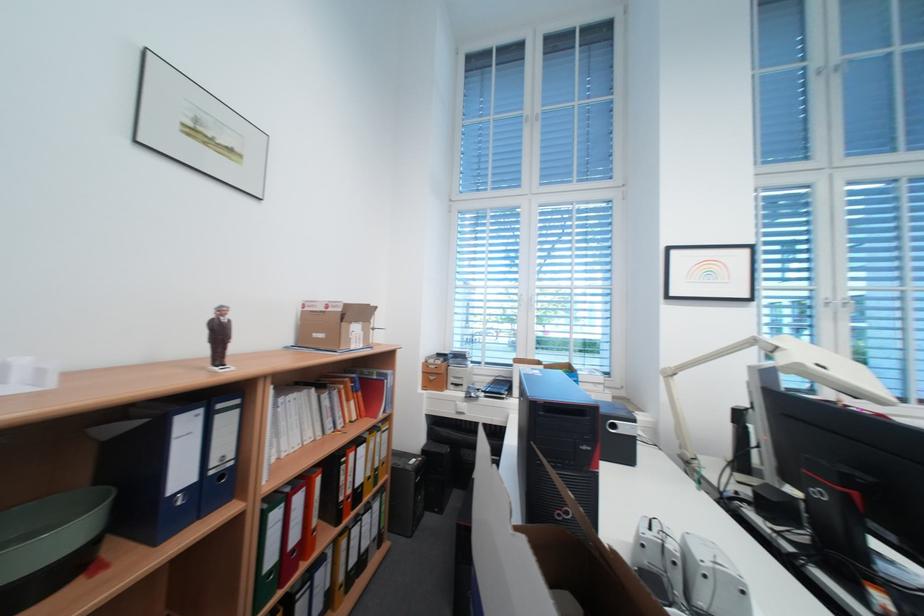
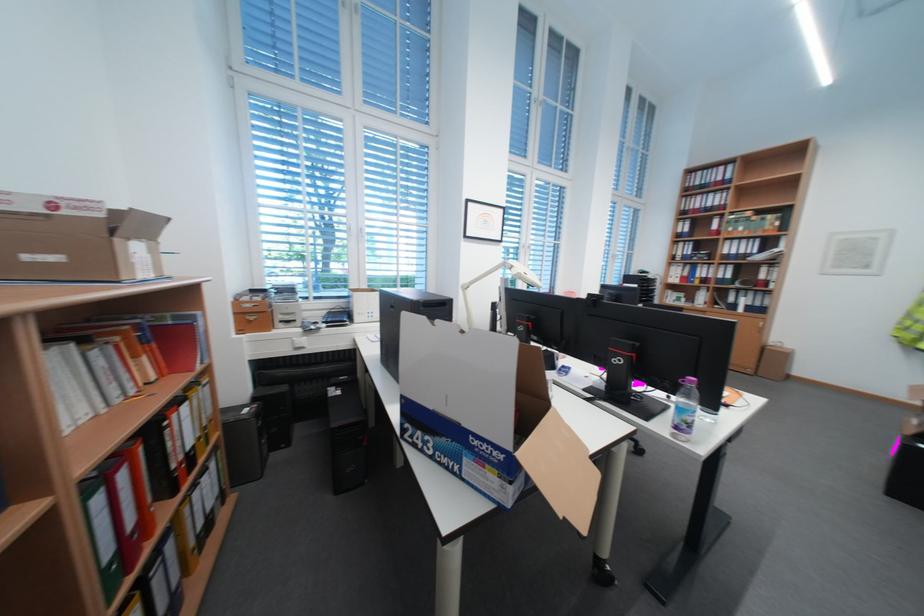
In the second image, find the point that corresponds to pixel 367 330 in the first image.

(148, 249)